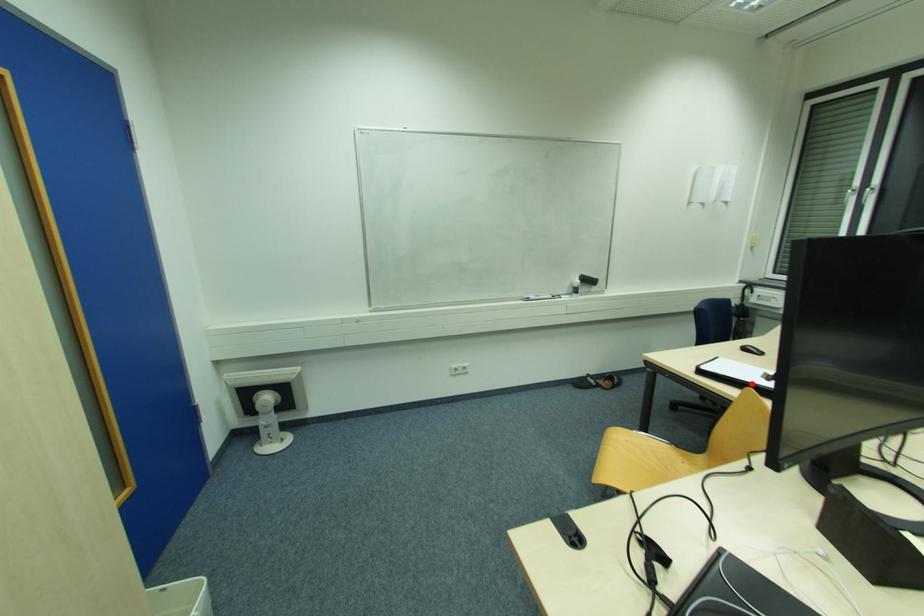
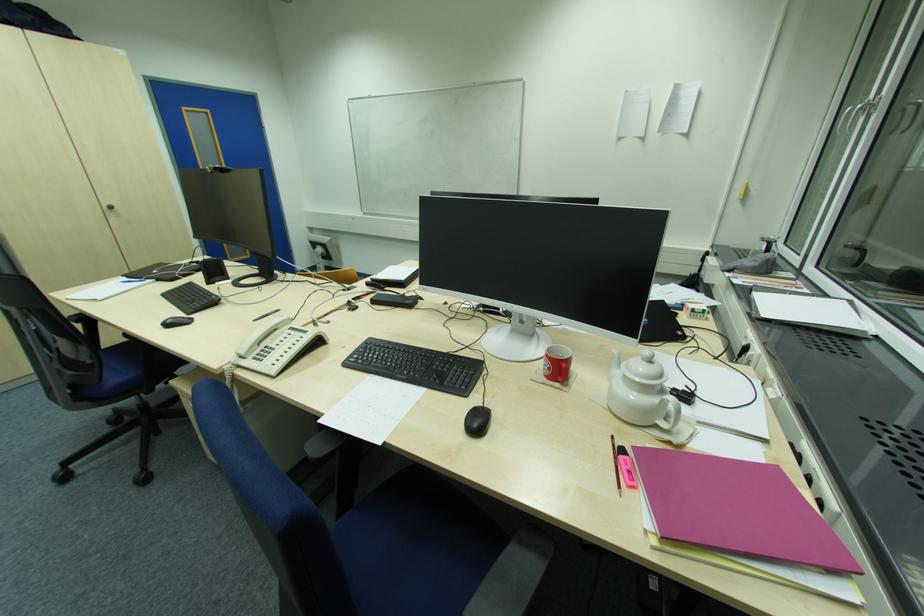
Find the pixel in the second image that matches the highlighted location in the first image.

(381, 275)